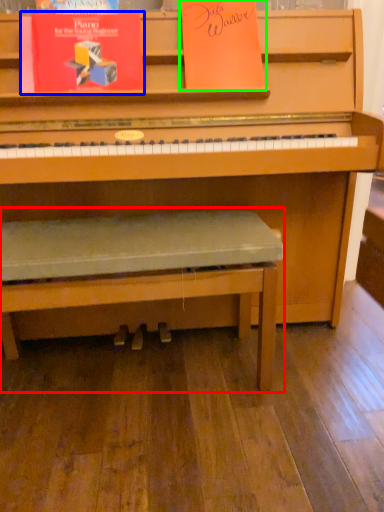
Question: Based on their relative distances, which object is farther from church bench (highlighted by a red box)? Choose from paperback book (highlighted by a blue box) and paperback book (highlighted by a green box).

Choices:
 (A) paperback book
 (B) paperback book

Answer: (B)